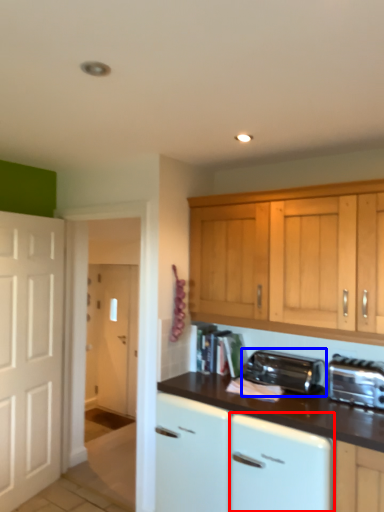
Question: Which object appears closest to the camera in this image, dish washer (highlighted by a red box) or kitchen appliance (highlighted by a blue box)?

Choices:
 (A) dish washer
 (B) kitchen appliance

Answer: (A)